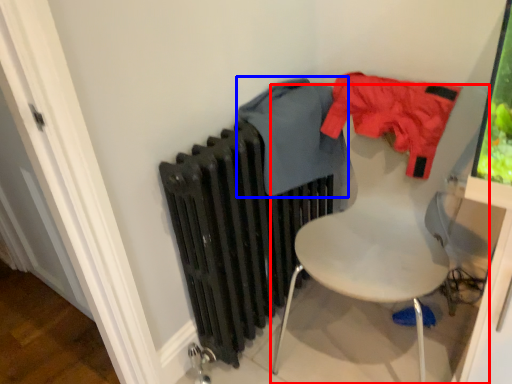
Question: Which object is closer to the camera taking this photo, chair (highlighted by a red box) or clothing (highlighted by a blue box)?

Choices:
 (A) chair
 (B) clothing

Answer: (A)